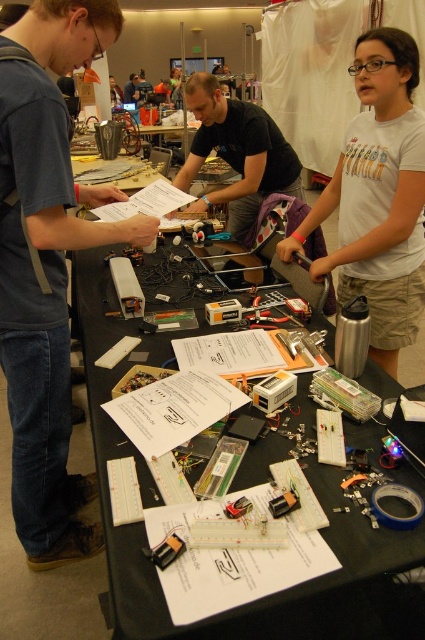
Question: Which of the following is the farthest from the observer?

Choices:
 (A) (408, 604)
 (B) (133, 77)

Answer: (B)

Question: Which point is closer to the camera?

Choices:
 (A) (178, 182)
 (B) (356, 564)

Answer: (B)

Question: Does black plastic table at center have a smaller size compared to black matte shirt at center?

Choices:
 (A) no
 (B) yes

Answer: (A)

Question: Does black plastic table at center lie behind matte black shirt at center?

Choices:
 (A) no
 (B) yes

Answer: (A)

Question: Which of these objects is positioned closest to the black matte shirt at center?

Choices:
 (A) white cotton shirt at upper center
 (B) matte black shirt at center

Answer: (A)

Question: Is white cotton shirt at upper center closer to the viewer compared to black matte shirt at center?

Choices:
 (A) no
 (B) yes

Answer: (B)